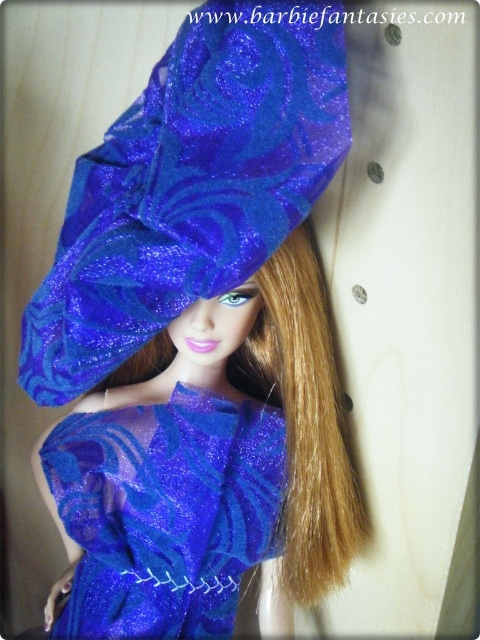
You are a collector who wants to display the shiny blue fabric hat at upper center on a shelf that is 28 inches away from your viewing position. Can the hat be placed on the shelf so that it is within your desired viewing distance?

The shiny blue fabric hat at upper center is 33.19 inches from the viewer. Since the shelf is only 28 inches away, placing the hat there would make it closer than your desired distance of 33.19 inches.

You are a fashion designer examining the doll. You need to determine the spatial relationship between the shiny blue fabric hat at upper center and the shiny blue fabric dress at center. Which object is positioned higher in the image?

The shiny blue fabric hat at upper center is located above the shiny blue fabric dress at center, so it is positioned higher in the image.

You are a tailor measuring the distance between the shiny blue fabric hat at upper center and the shiny blue fabric dress at center for a custom fit. Given that the minimum required distance for proper adjustment is 25 centimeters, can the current spacing accommodate the adjustments?

The distance between the shiny blue fabric hat at upper center and the shiny blue fabric dress at center is 25.84 centimeters, which exceeds the minimum requirement of 25 centimeters. Therefore, the current spacing can accommodate the adjustments.